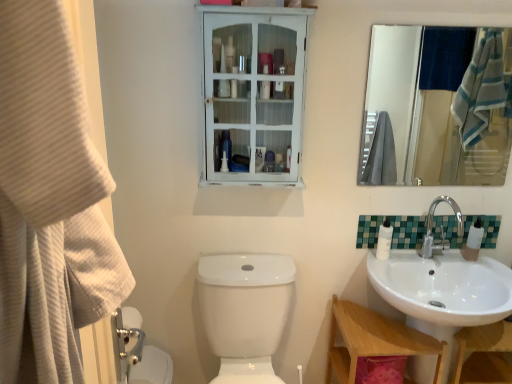
Question: Is white distressed wood medicine cabinet at upper center bigger or smaller than white glossy lotion at right?

Choices:
 (A) big
 (B) small

Answer: (A)

Question: Is white distressed wood medicine cabinet at upper center in front of or behind white glossy lotion at right in the image?

Choices:
 (A) behind
 (B) front

Answer: (B)

Question: Estimate the real-world distances between objects in this image. Which object is closer to the beige textured towel at left?

Choices:
 (A) green mosaic tile at right
 (B) white glossy toilet bowl at lower left, the first toilet bowl when ordered from left to right
 (C) white glossy toilet bowl at lower center, acting as the second toilet bowl starting from the left
 (D) chrome metallic faucet at right
 (E) wooden at lower right

Answer: (C)

Question: Estimate the real-world distances between objects in this image. Which object is farther from the white distressed wood medicine cabinet at upper center?

Choices:
 (A) white glossy lotion at right
 (B) chrome metallic faucet at right
 (C) white glossy toilet bowl at lower left, acting as the second toilet bowl starting from the right
 (D) wooden at lower right
 (E) white glossy toilet bowl at lower center, marked as the 1th toilet bowl in a right-to-left arrangement

Answer: (C)